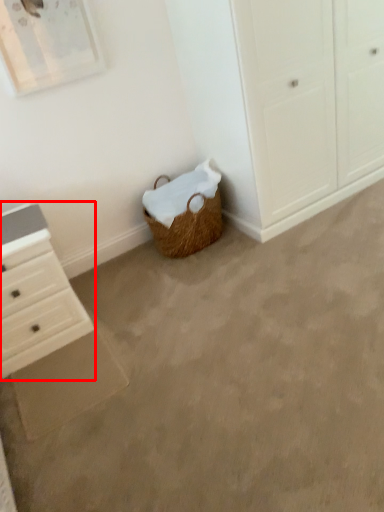
Question: In this image, where is chest of drawers (annotated by the red box) located relative to concrete?

Choices:
 (A) right
 (B) left

Answer: (B)